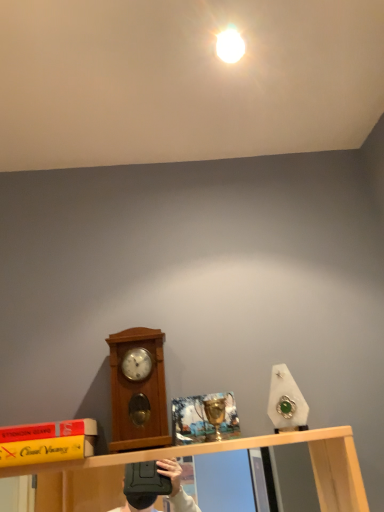
Question: From the image's perspective, is white glossy light bulb at upper center above or below wooden clock at left?

Choices:
 (A) below
 (B) above

Answer: (B)

Question: Considering the positions of white glossy light bulb at upper center and wooden clock at left in the image, is white glossy light bulb at upper center wider or thinner than wooden clock at left?

Choices:
 (A) wide
 (B) thin

Answer: (B)

Question: From a real-world perspective, relative to wooden clock at left, is white glossy light bulb at upper center vertically above or below?

Choices:
 (A) below
 (B) above

Answer: (B)

Question: Considering their positions, is wooden clock at left located in front of or behind white glossy light bulb at upper center?

Choices:
 (A) front
 (B) behind

Answer: (A)

Question: Does point (150, 381) appear closer or farther from the camera than point (216, 40)?

Choices:
 (A) closer
 (B) farther

Answer: (B)

Question: Considering the relative positions of wooden clock at left and white glossy light bulb at upper center in the image provided, is wooden clock at left to the left or to the right of white glossy light bulb at upper center?

Choices:
 (A) left
 (B) right

Answer: (A)

Question: In terms of size, does wooden clock at left appear bigger or smaller than white glossy light bulb at upper center?

Choices:
 (A) big
 (B) small

Answer: (A)